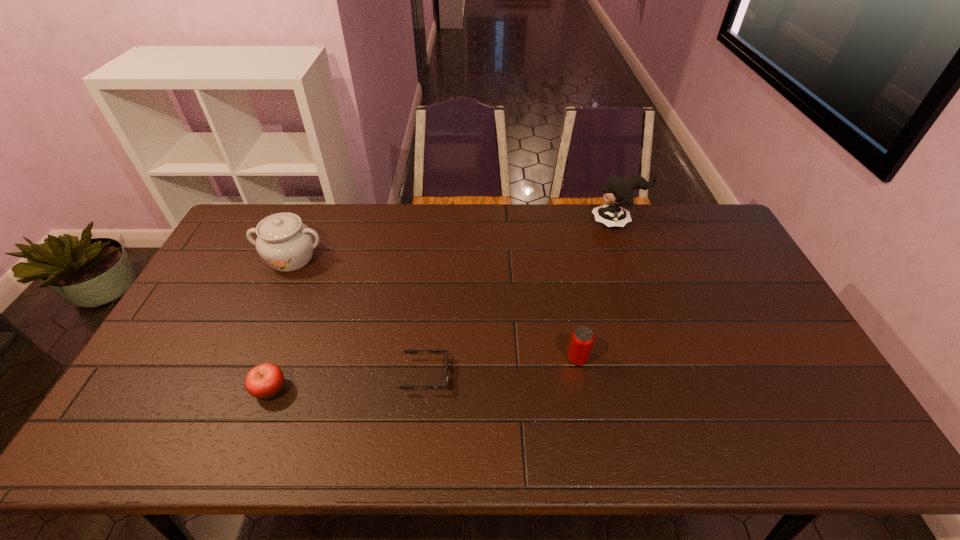
Locate an element on the screen. The height and width of the screenshot is (540, 960). vacant point located between the third tallest object and the rightmost object is located at coordinates (597, 291).

Where is `vacant region between the tallest object and the third tallest object`? vacant region between the tallest object and the third tallest object is located at coordinates (597, 291).

In order to click on vacant area between the apple and the sunglasses in this screenshot , I will do `click(348, 382)`.

Find the location of a particular element. This screenshot has height=540, width=960. vacant point located between the farthest object and the apple is located at coordinates click(x=444, y=306).

Locate an element on the screen. This screenshot has height=540, width=960. free point between the fourth nearest object and the apple is located at coordinates (280, 323).

This screenshot has height=540, width=960. I want to click on free spot between the sunglasses and the apple, so click(x=348, y=382).

Identify which object is the fourth nearest to the second object from right to left. Please provide its 2D coordinates. Your answer should be formatted as a tuple, i.e. [(x, y)], where the tuple contains the x and y coordinates of a point satisfying the conditions above.

[(286, 244)]

Locate which object is the closest to the third object from right to left. Please provide its 2D coordinates. Your answer should be formatted as a tuple, i.e. [(x, y)], where the tuple contains the x and y coordinates of a point satisfying the conditions above.

[(264, 381)]

Where is `vacant region that satisfies the following two spatial constraints: 1. at the face of the farthest object; 2. on the front side of the second tallest object`? This screenshot has height=540, width=960. vacant region that satisfies the following two spatial constraints: 1. at the face of the farthest object; 2. on the front side of the second tallest object is located at coordinates (630, 258).

The width and height of the screenshot is (960, 540). Identify the location of vacant region that satisfies the following two spatial constraints: 1. at the face of the doll; 2. on the front side of the second shortest object. (677, 389).